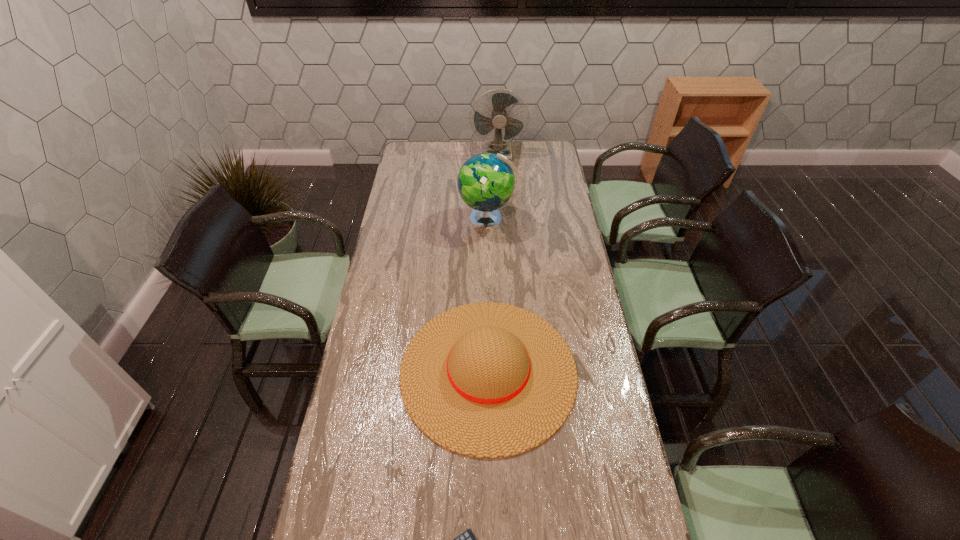
What are the coordinates of `fan` in the screenshot? It's located at (500, 101).

The height and width of the screenshot is (540, 960). In order to click on the third nearest object in this screenshot , I will do `click(486, 182)`.

Locate an element on the screen. The image size is (960, 540). bonnet is located at coordinates (488, 380).

Image resolution: width=960 pixels, height=540 pixels. I want to click on the third tallest object, so click(488, 380).

You are a GUI agent. You are given a task and a screenshot of the screen. Output one action in this format:
    pyautogui.click(x=<x>, y=<y>)
    Task: Click on the vacant space situated 0.360m on the front-facing side of the farthest object
    
    Given the screenshot: What is the action you would take?
    pyautogui.click(x=501, y=202)

Where is `vacant space located on the front surface of the globe`? This screenshot has height=540, width=960. vacant space located on the front surface of the globe is located at coordinates (437, 220).

Find the location of a particular element. This screenshot has height=540, width=960. vacant space situated on the front surface of the globe is located at coordinates (406, 220).

The image size is (960, 540). What are the coordinates of `vacant space located 0.190m on the front surface of the globe` in the screenshot? It's located at (418, 220).

I want to click on free space located on the back of the second nearest object, so click(x=487, y=252).

Identify the location of object at the far edge. Image resolution: width=960 pixels, height=540 pixels. (500, 101).